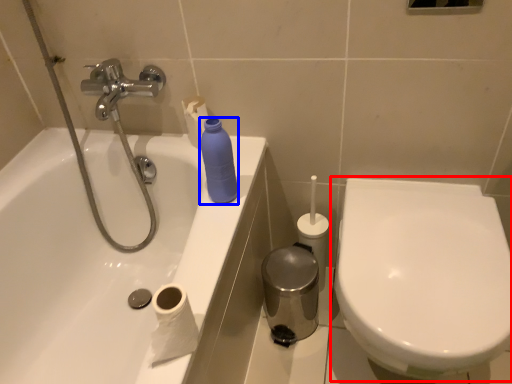
Question: Which of the following is the farthest to the observer, toilet (highlighted by a red box) or cleaning product (highlighted by a blue box)?

Choices:
 (A) toilet
 (B) cleaning product

Answer: (B)